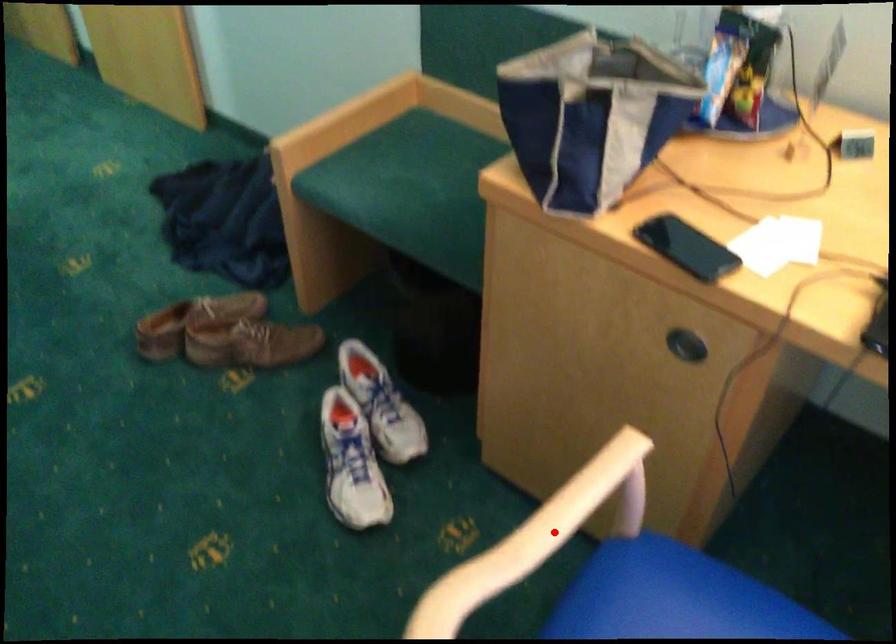
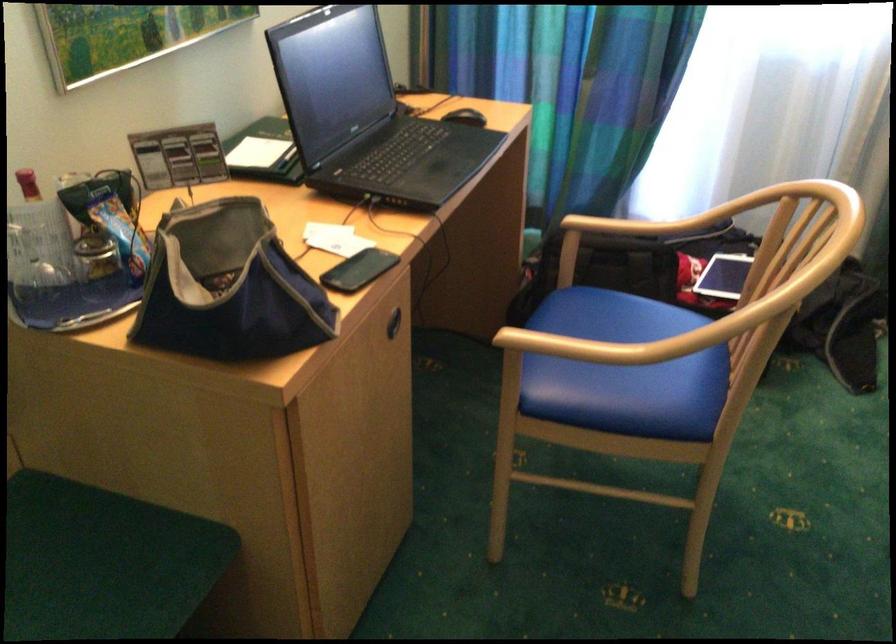
Question: I am providing you with two images of the same scene from different viewpoints. Given a red point in image1, look at the same physical point in image2. Is it:

Choices:
 (A) Closer to the viewpoint
 (B) Farther from the viewpoint

Answer: (B)